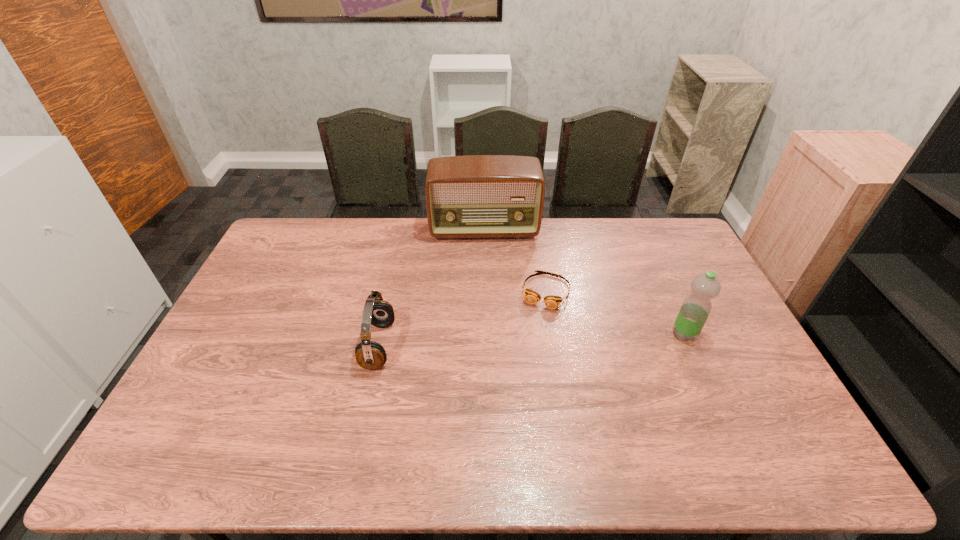
Image resolution: width=960 pixels, height=540 pixels. Identify the location of vacant space that is in between the shortest object and the farthest object. (516, 261).

You are a GUI agent. You are given a task and a screenshot of the screen. Output one action in this format:
    pyautogui.click(x=<x>, y=<y>)
    Task: Click on the free area in between the third tallest object and the water bottle
    The height and width of the screenshot is (540, 960).
    Given the screenshot: What is the action you would take?
    pyautogui.click(x=532, y=340)

At what (x,y) coordinates should I click in order to perform the action: click on blank region between the second shortest object and the goggles. Please return your answer as a coordinate pair (x, y). This screenshot has width=960, height=540. Looking at the image, I should click on (463, 319).

Identify which object is located as the second nearest to the third shortest object. Please provide its 2D coordinates. Your answer should be formatted as a tuple, i.e. [(x, y)], where the tuple contains the x and y coordinates of a point satisfying the conditions above.

[(475, 196)]

Choose which object is the nearest neighbor to the radio receiver. Please provide its 2D coordinates. Your answer should be formatted as a tuple, i.e. [(x, y)], where the tuple contains the x and y coordinates of a point satisfying the conditions above.

[(552, 302)]

Find the location of `free location that satisfies the following two spatial constraints: 1. on the front side of the goggles; 2. on the left side of the radio receiver`. free location that satisfies the following two spatial constraints: 1. on the front side of the goggles; 2. on the left side of the radio receiver is located at coordinates (485, 292).

Identify the location of free space that satisfies the following two spatial constraints: 1. on the front side of the radio receiver; 2. on the right side of the rightmost object. (486, 334).